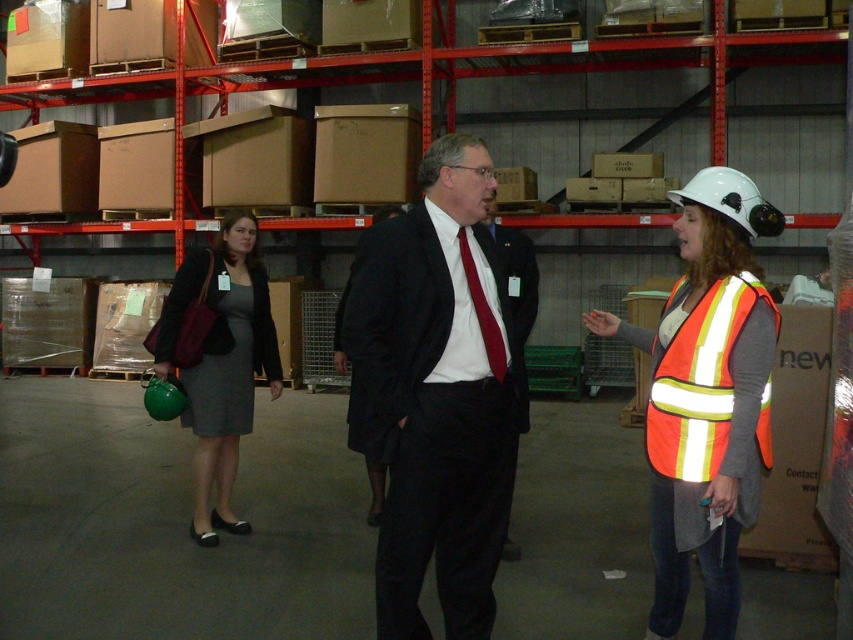
Between dark suit at center and matte black suit at center, which one has less height?

matte black suit at center is shorter.

The width and height of the screenshot is (853, 640). What do you see at coordinates (439, 392) in the screenshot?
I see `dark suit at center` at bounding box center [439, 392].

Identify the location of dark suit at center. (439, 392).

Can you confirm if reflective orange safety vest at center is bigger than reflective orange safety vest at right?

Indeed, reflective orange safety vest at center has a larger size compared to reflective orange safety vest at right.

Describe the element at coordinates (706, 396) in the screenshot. The width and height of the screenshot is (853, 640). I see `reflective orange safety vest at center` at that location.

Where is `reflective orange safety vest at center`? reflective orange safety vest at center is located at coordinates (706, 396).

Where is `reflective orange safety vest at right`? reflective orange safety vest at right is located at coordinates (699, 381).